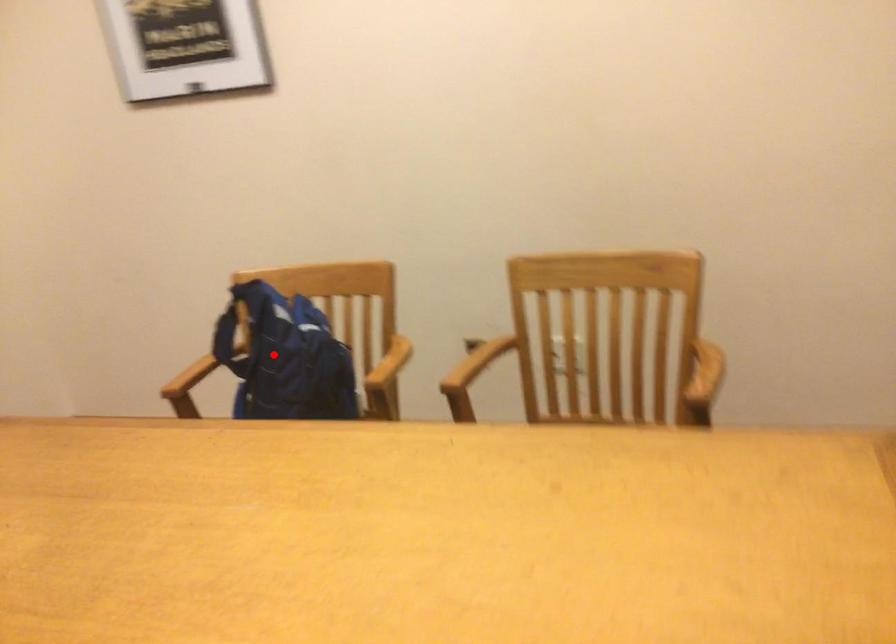
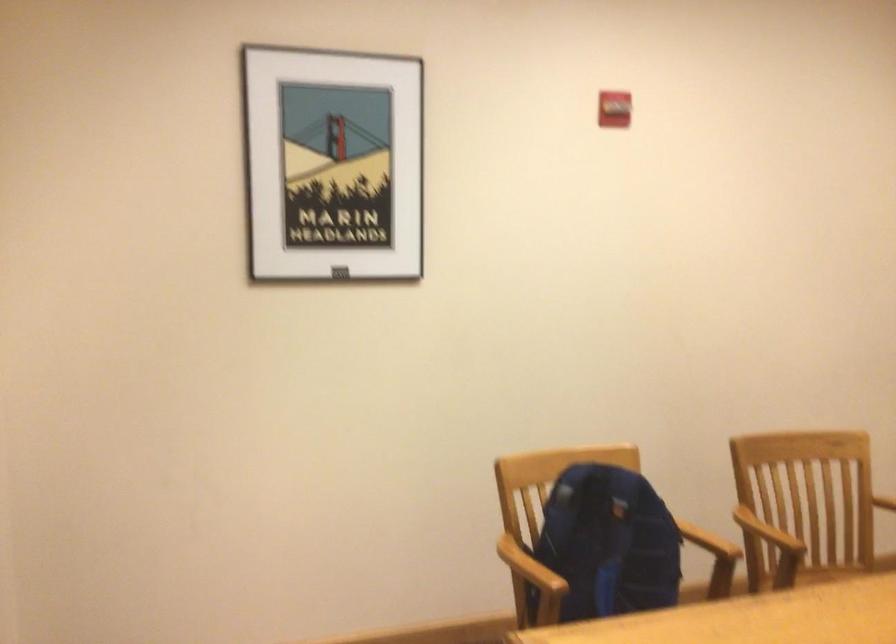
Locate, in the second image, the point that corresponds to the highlighted location in the first image.

(607, 544)